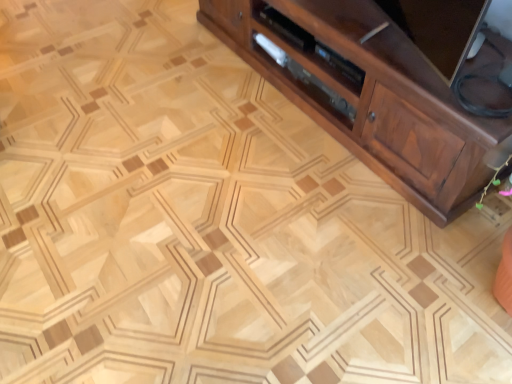
Question: Is brown wood cabinet at right to the right of satin wood drawer at center from the viewer's perspective?

Choices:
 (A) yes
 (B) no

Answer: (A)

Question: Considering the relative positions of brown wood cabinet at right and satin wood drawer at center in the image provided, is brown wood cabinet at right in front of satin wood drawer at center?

Choices:
 (A) no
 (B) yes

Answer: (B)

Question: Is brown wood cabinet at right to the left of satin wood drawer at center from the viewer's perspective?

Choices:
 (A) yes
 (B) no

Answer: (B)

Question: Can you confirm if brown wood cabinet at right is thinner than satin wood drawer at center?

Choices:
 (A) yes
 (B) no

Answer: (B)

Question: Is brown wood cabinet at right further to camera compared to satin wood drawer at center?

Choices:
 (A) no
 (B) yes

Answer: (A)

Question: Would you say satin wood drawer at center is part of brown wood cabinet at right's contents?

Choices:
 (A) no
 (B) yes

Answer: (B)

Question: Considering the relative positions of satin wood drawer at center and brown wood cabinet at right in the image provided, is satin wood drawer at center to the left of brown wood cabinet at right from the viewer's perspective?

Choices:
 (A) yes
 (B) no

Answer: (A)

Question: Considering the relative sizes of satin wood drawer at center and brown wood cabinet at right in the image provided, is satin wood drawer at center taller than brown wood cabinet at right?

Choices:
 (A) yes
 (B) no

Answer: (B)

Question: Is satin wood drawer at center with brown wood cabinet at right?

Choices:
 (A) yes
 (B) no

Answer: (B)

Question: Is satin wood drawer at center oriented towards brown wood cabinet at right?

Choices:
 (A) no
 (B) yes

Answer: (B)

Question: Considering the relative sizes of satin wood drawer at center and brown wood cabinet at right in the image provided, is satin wood drawer at center bigger than brown wood cabinet at right?

Choices:
 (A) no
 (B) yes

Answer: (A)

Question: Is satin wood drawer at center oriented away from brown wood cabinet at right?

Choices:
 (A) no
 (B) yes

Answer: (B)

Question: Is point (415, 16) positioned closer to the camera than point (275, 61)?

Choices:
 (A) closer
 (B) farther

Answer: (A)